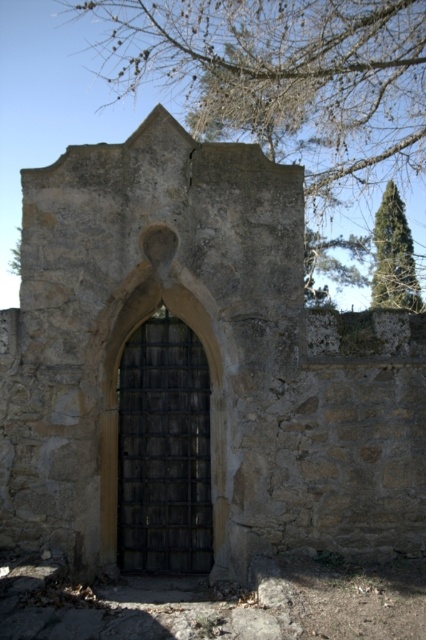
Question: Which point appears farthest from the camera in this image?

Choices:
 (A) (137, 8)
 (B) (155, 352)
 (C) (382, 307)

Answer: (C)

Question: Is bare branches at upper center below dark brown wooden door at center?

Choices:
 (A) yes
 (B) no

Answer: (B)

Question: Is dark brown wooden door at center positioned behind green coniferous tree at upper right?

Choices:
 (A) yes
 (B) no

Answer: (B)

Question: Among these points, which one is farthest from the camera?

Choices:
 (A) (325, 108)
 (B) (383, 241)
 (C) (123, 387)

Answer: (B)

Question: Which point appears farthest from the camera in this image?

Choices:
 (A) (373, 273)
 (B) (363, 164)
 (C) (123, 564)

Answer: (A)

Question: Is bare branches at upper center below green coniferous tree at upper right?

Choices:
 (A) no
 (B) yes

Answer: (A)